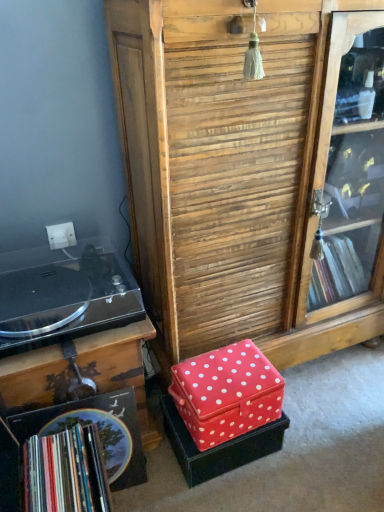
The image size is (384, 512). I want to click on spots to the right of red fabric box at center, the first storage box positioned from the bottom, so click(310, 446).